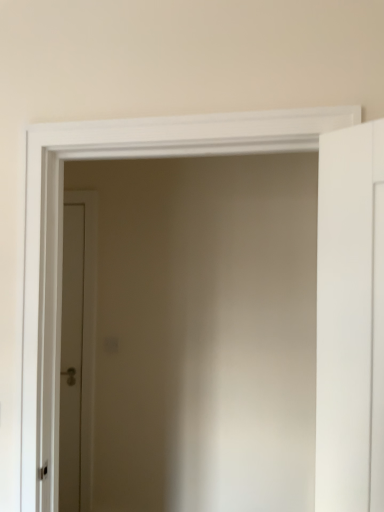
Find the location of a particular element. white matte door at right, arranged as the 2th door when viewed from the back is located at coordinates (350, 320).

What is the approximate height of white matte door at right, the 1th door viewed from the front?

white matte door at right, the 1th door viewed from the front, is 1.01 meters tall.

Describe the element at coordinates (350, 320) in the screenshot. The width and height of the screenshot is (384, 512). I see `white matte door at right, arranged as the 2th door when viewed from the back` at that location.

Where is `brown matte door at center, marked as the 2th door in a front-to-back arrangement`? The height and width of the screenshot is (512, 384). brown matte door at center, marked as the 2th door in a front-to-back arrangement is located at coordinates (78, 350).

Looking at this image, measure the distance between point (86, 284) and camera.

Point (86, 284) and camera are 2.59 meters apart.

What do you see at coordinates (78, 350) in the screenshot? I see `brown matte door at center, positioned as the first door in back-to-front order` at bounding box center [78, 350].

In order to click on white matte door at right, the second door from the left in this screenshot , I will do `click(350, 320)`.

Is brown matte door at center, marked as the 2th door in a front-to-back arrangement, to the left of white matte door at right, the 1th door viewed from the front, from the viewer's perspective?

Correct, you'll find brown matte door at center, marked as the 2th door in a front-to-back arrangement, to the left of white matte door at right, the 1th door viewed from the front.

Considering the positions of objects brown matte door at center, the second door from the right, and white matte door at right, acting as the first door starting from the right, in the image provided, who is in front, brown matte door at center, the second door from the right, or white matte door at right, acting as the first door starting from the right,?

white matte door at right, acting as the first door starting from the right, is in front.

Which is behind, point (85, 394) or point (352, 130)?

Point (85, 394)

From the image's perspective, which one is positioned lower, brown matte door at center, marked as the 1th door in a left-to-right arrangement, or white matte door at right, the 1th door viewed from the front?

brown matte door at center, marked as the 1th door in a left-to-right arrangement, from the image's perspective.

From a real-world perspective, relative to white matte door at right, arranged as the 2th door when viewed from the back, is brown matte door at center, the second door from the right, vertically above or below?

In terms of real-world spatial position, brown matte door at center, the second door from the right, is below white matte door at right, arranged as the 2th door when viewed from the back.

Which object is wider, brown matte door at center, positioned as the first door in back-to-front order, or white matte door at right, the second door from the left?

Wider between the two is white matte door at right, the second door from the left.

Is brown matte door at center, marked as the 1th door in a left-to-right arrangement, taller or shorter than white matte door at right, arranged as the 2th door when viewed from the back?

brown matte door at center, marked as the 1th door in a left-to-right arrangement, is taller than white matte door at right, arranged as the 2th door when viewed from the back.

Between brown matte door at center, marked as the 1th door in a left-to-right arrangement, and white matte door at right, arranged as the 2th door when viewed from the back, which one has larger size?

With larger size is brown matte door at center, marked as the 1th door in a left-to-right arrangement.

Is brown matte door at center, marked as the 1th door in a left-to-right arrangement, outside of white matte door at right, the second door from the left?

Yes, brown matte door at center, marked as the 1th door in a left-to-right arrangement, is located beyond the bounds of white matte door at right, the second door from the left.

From the picture: Is brown matte door at center, marked as the 2th door in a front-to-back arrangement, next to white matte door at right, arranged as the 2th door when viewed from the back?

They are not placed beside each other.

Is brown matte door at center, positioned as the first door in back-to-front order, looking in the opposite direction of white matte door at right, the 1th door viewed from the front?

brown matte door at center, positioned as the first door in back-to-front order, does not have its back to white matte door at right, the 1th door viewed from the front.

What's the angular difference between brown matte door at center, marked as the 2th door in a front-to-back arrangement, and white matte door at right, arranged as the 2th door when viewed from the back,'s facing directions?

brown matte door at center, marked as the 2th door in a front-to-back arrangement, and white matte door at right, arranged as the 2th door when viewed from the back, are facing 40.1 degrees away from each other.

Image resolution: width=384 pixels, height=512 pixels. I want to click on door to the left of white matte door at right, acting as the first door starting from the right, so click(x=78, y=350).

Between white matte door at right, the second door from the left, and brown matte door at center, marked as the 2th door in a front-to-back arrangement, which one appears on the left side from the viewer's perspective?

brown matte door at center, marked as the 2th door in a front-to-back arrangement.

Is white matte door at right, the 1th door viewed from the front, positioned behind brown matte door at center, marked as the 2th door in a front-to-back arrangement?

No, the depth of white matte door at right, the 1th door viewed from the front, is less than that of brown matte door at center, marked as the 2th door in a front-to-back arrangement.

Does point (327, 429) come closer to viewer compared to point (96, 245)?

Yes, point (327, 429) is closer to viewer.

From the image's perspective, is white matte door at right, acting as the first door starting from the right, above or below brown matte door at center, the second door from the right?

Based on their image positions, white matte door at right, acting as the first door starting from the right, is located above brown matte door at center, the second door from the right.

From a real-world perspective, is white matte door at right, the second door from the left, below brown matte door at center, marked as the 1th door in a left-to-right arrangement?

No, from a real-world perspective, white matte door at right, the second door from the left, is not below brown matte door at center, marked as the 1th door in a left-to-right arrangement.

In terms of width, does white matte door at right, the second door from the left, look wider or thinner when compared to brown matte door at center, the second door from the right?

Clearly, white matte door at right, the second door from the left, has more width compared to brown matte door at center, the second door from the right.

In terms of height, does white matte door at right, the second door from the left, look taller or shorter compared to brown matte door at center, marked as the 2th door in a front-to-back arrangement?

white matte door at right, the second door from the left, is shorter than brown matte door at center, marked as the 2th door in a front-to-back arrangement.

Is white matte door at right, the second door from the left, bigger or smaller than brown matte door at center, positioned as the first door in back-to-front order?

Considering their sizes, white matte door at right, the second door from the left, takes up less space than brown matte door at center, positioned as the first door in back-to-front order.

Can we say white matte door at right, arranged as the 2th door when viewed from the back, lies outside brown matte door at center, marked as the 1th door in a left-to-right arrangement?

Yes, white matte door at right, arranged as the 2th door when viewed from the back, is outside of brown matte door at center, marked as the 1th door in a left-to-right arrangement.

Is white matte door at right, acting as the first door starting from the right, touching brown matte door at center, the second door from the right?

They are not placed beside each other.

Could you tell me if white matte door at right, the second door from the left, is turned towards brown matte door at center, the second door from the right?

No, white matte door at right, the second door from the left, does not turn towards brown matte door at center, the second door from the right.

Can you tell me how much white matte door at right, arranged as the 2th door when viewed from the back, and brown matte door at center, marked as the 2th door in a front-to-back arrangement, differ in facing direction?

The angle between the facing direction of white matte door at right, arranged as the 2th door when viewed from the back, and the facing direction of brown matte door at center, marked as the 2th door in a front-to-back arrangement, is 40.1 degrees.

The width and height of the screenshot is (384, 512). In order to click on door in front of the brown matte door at center, positioned as the first door in back-to-front order in this screenshot , I will do `click(350, 320)`.

Where is `door below the white matte door at right, the 1th door viewed from the front (from a real-world perspective)`? The width and height of the screenshot is (384, 512). door below the white matte door at right, the 1th door viewed from the front (from a real-world perspective) is located at coordinates (78, 350).

The width and height of the screenshot is (384, 512). Identify the location of door that is behind the white matte door at right, arranged as the 2th door when viewed from the back. (78, 350).